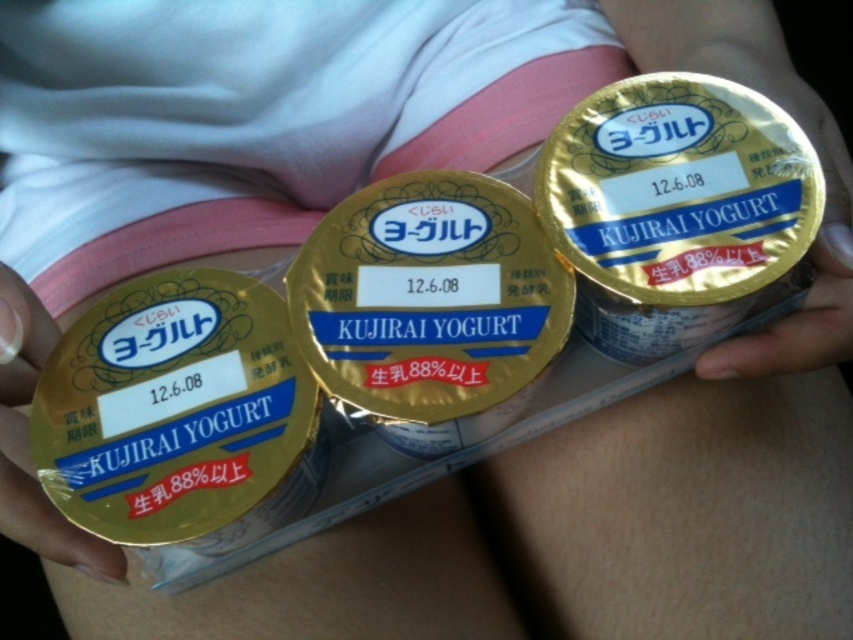
You are a nutritionist examining two yogurt containers in the image. The first is the metallic gold yogurt container at upper right, and the second is the gold foil yogurt container at center. Which one is taller?

The metallic gold yogurt container at upper right is taller than the gold foil yogurt container at center.

You are holding a map and looking at two points marked on it. The first point is labeled as point (804, 120) and the second point is labeled as point (33, 372). According to the map, which point is closer to you?

Point (33, 372) is closer to you because it is in front of point (804, 120).

You are a food safety inspector checking the expiration dates on the yogurt containers. You notice that the metallic gold yogurt container at upper right and the gold foil yogurt container at center have the same expiration date. Which container would you recommend to a customer who wants to consume the yogurt as soon as possible?

The metallic gold yogurt container at upper right is bigger than the gold foil yogurt container at center, so it might be consumed faster if the customer needs a larger portion immediately.